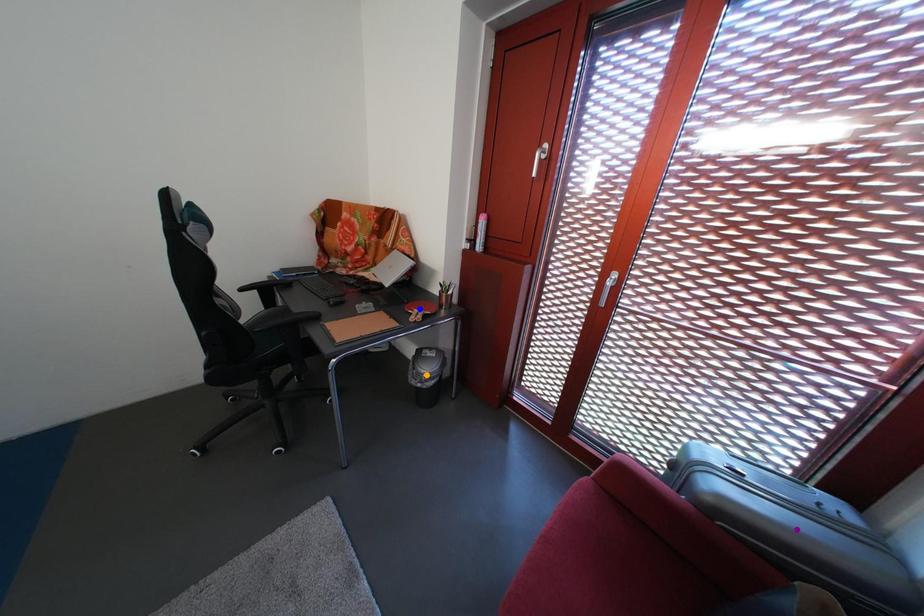
Order these from nearest to farthest:
blue point
orange point
purple point

purple point → blue point → orange point